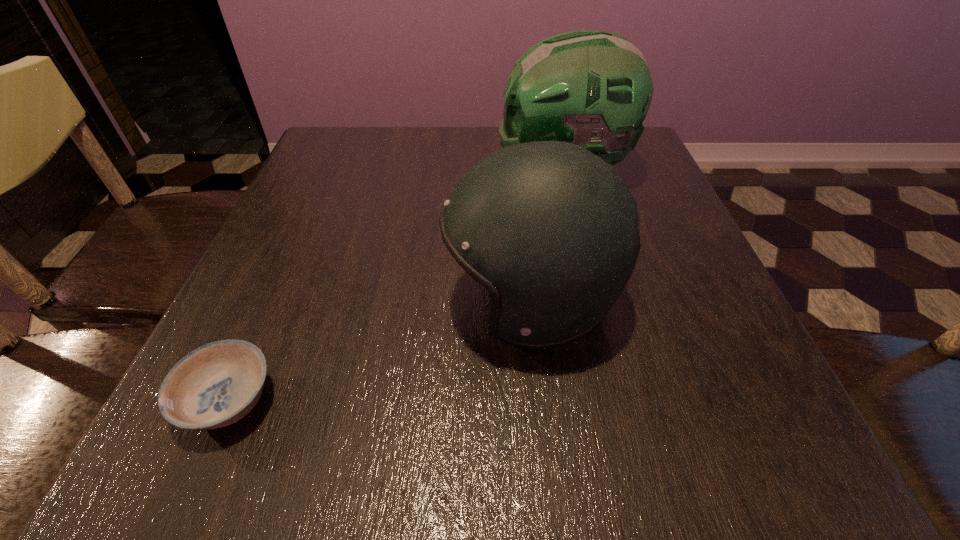
Find the location of a particular element. free space located on the back of the shortest object is located at coordinates (274, 300).

At what (x,y) coordinates should I click in order to perform the action: click on object positioned at the far edge. Please return your answer as a coordinate pair (x, y). Looking at the image, I should click on (591, 88).

Find the location of a particular element. object that is positioned at the near edge is located at coordinates (216, 385).

Identify the location of object located in the left edge section of the desktop. The height and width of the screenshot is (540, 960). (216, 385).

This screenshot has width=960, height=540. In order to click on object at the right edge in this screenshot , I will do [x=591, y=88].

I want to click on object located at the near left corner, so click(216, 385).

Image resolution: width=960 pixels, height=540 pixels. Find the location of `object located in the far right corner section of the desktop`. object located in the far right corner section of the desktop is located at coordinates (591, 88).

The image size is (960, 540). What are the coordinates of `vacant space at the far edge of the desktop` in the screenshot? It's located at point(390,167).

Where is `blank space at the near edge of the desktop`? Image resolution: width=960 pixels, height=540 pixels. blank space at the near edge of the desktop is located at coordinates (637, 435).

I want to click on vacant space at the left edge, so click(x=302, y=374).